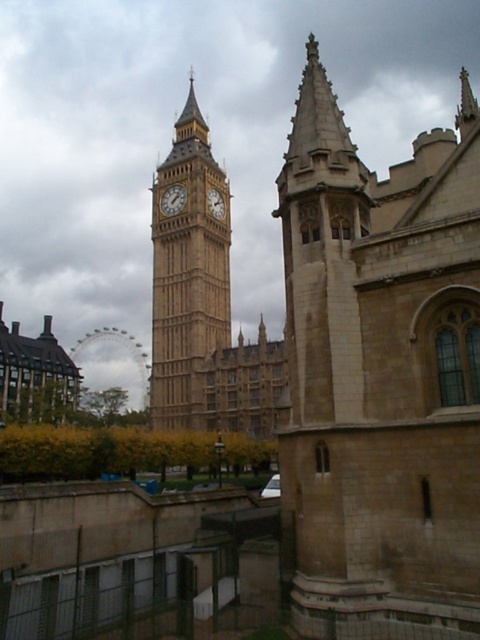
Can you confirm if beige stone tower at upper right is taller than golden stone clock tower at center?

Correct, beige stone tower at upper right is much taller as golden stone clock tower at center.

Measure the distance between beige stone tower at upper right and golden stone clock tower at center.

beige stone tower at upper right is 52.98 meters from golden stone clock tower at center.

Who is more distant from viewer, (440,624) or (188,392)?

The point (188,392) is more distant.

What are the coordinates of `beige stone tower at upper right` in the screenshot? It's located at (382, 376).

Is golden stone clock tower at center behind golden stone clock tower at center-left?

No, it is in front of golden stone clock tower at center-left.

Image resolution: width=480 pixels, height=640 pixels. Identify the location of golden stone clock tower at center. (188, 276).

Does beige stone tower at upper right have a lesser height compared to gold textured clock at center?

No.

Is beige stone tower at upper right thinner than gold textured clock at center?

No, beige stone tower at upper right is not thinner than gold textured clock at center.

This screenshot has width=480, height=640. Identify the location of beige stone tower at upper right. (382, 376).